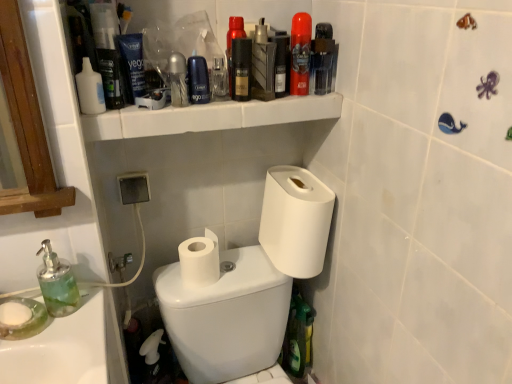
Locate an element on the screen. The image size is (512, 384). free point above white matte toilet paper at right, the first toilet paper viewed from the right (from a real-world perspective) is located at coordinates (298, 181).